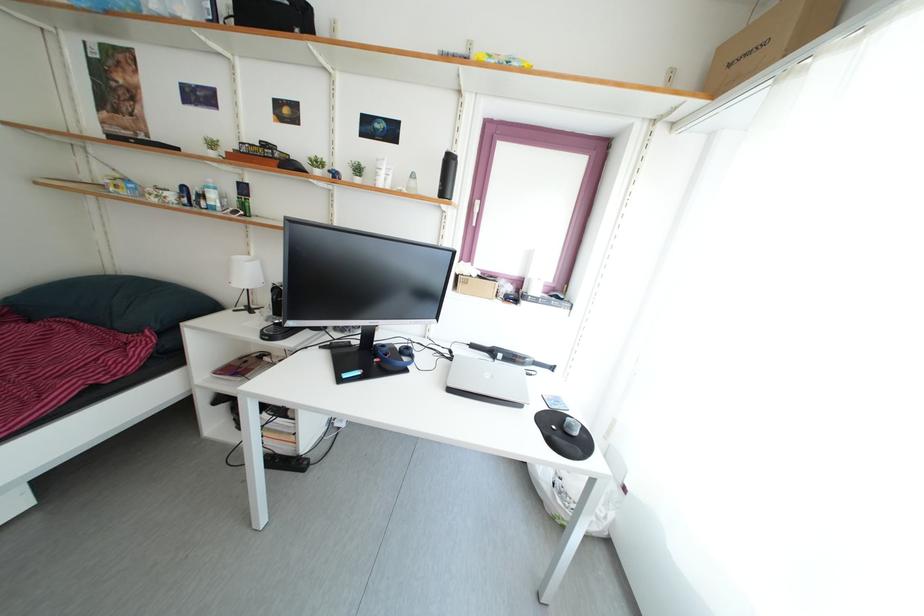
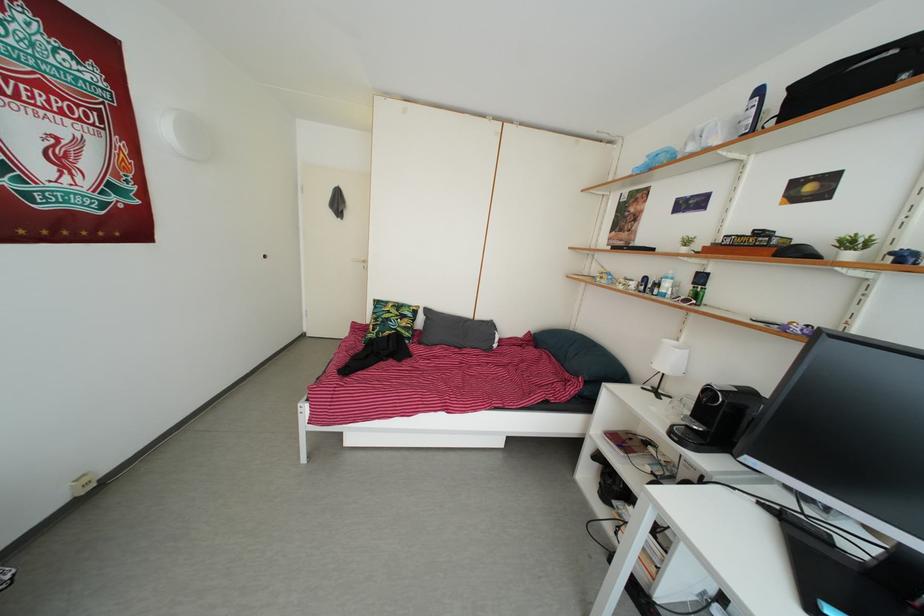
The point at [246,192] is marked in the first image. Where is the corresponding point in the second image?

(704, 282)